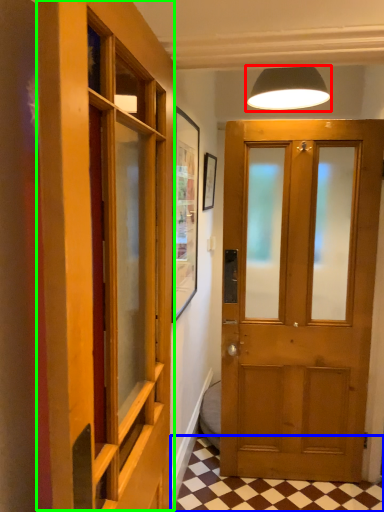
Question: Considering the real-world distances, which object is closest to lamp (highlighted by a red box)? tile (highlighted by a blue box) or elevator (highlighted by a green box).

Choices:
 (A) tile
 (B) elevator

Answer: (B)